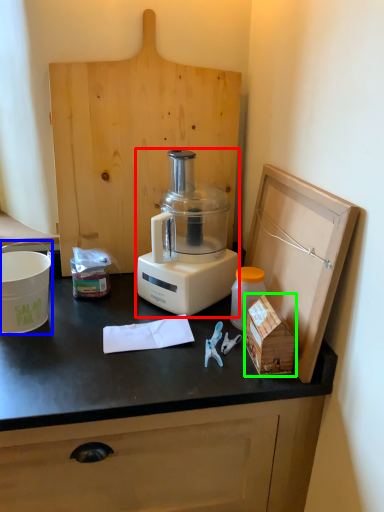
Question: Estimate the real-world distances between objects in this image. Which object is farther from blender (highlighted by a red box), appliance (highlighted by a blue box) or wood (highlighted by a green box)?

Choices:
 (A) appliance
 (B) wood

Answer: (A)